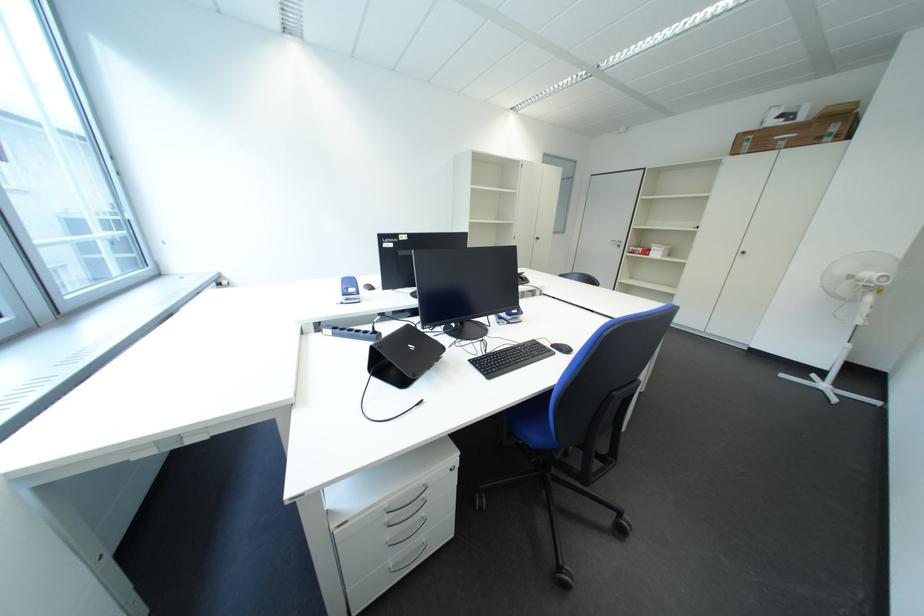
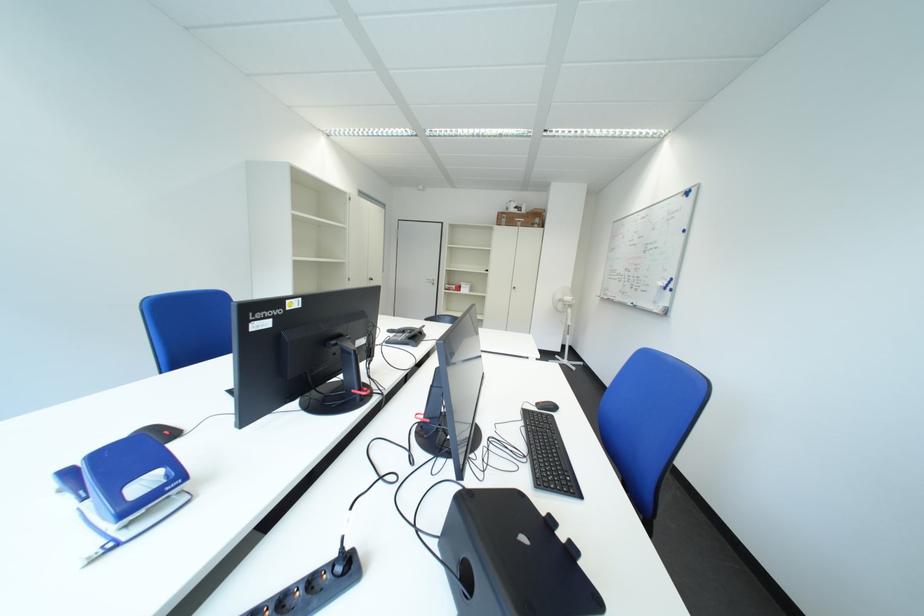
Find the pixel in the second image that matches [759,147] in the first image.

(517, 223)